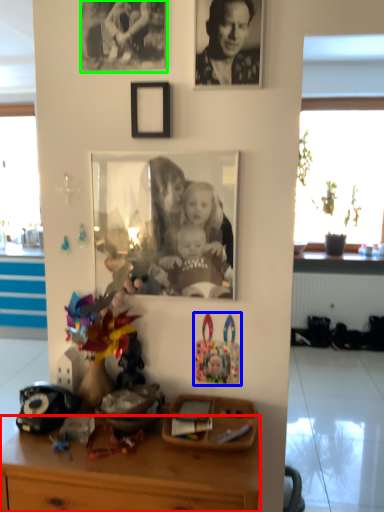
Question: Based on their relative distances, which object is farther from desk (highlighted by a red box)? Choose from toy (highlighted by a blue box) and picture frame (highlighted by a green box).

Choices:
 (A) toy
 (B) picture frame

Answer: (B)